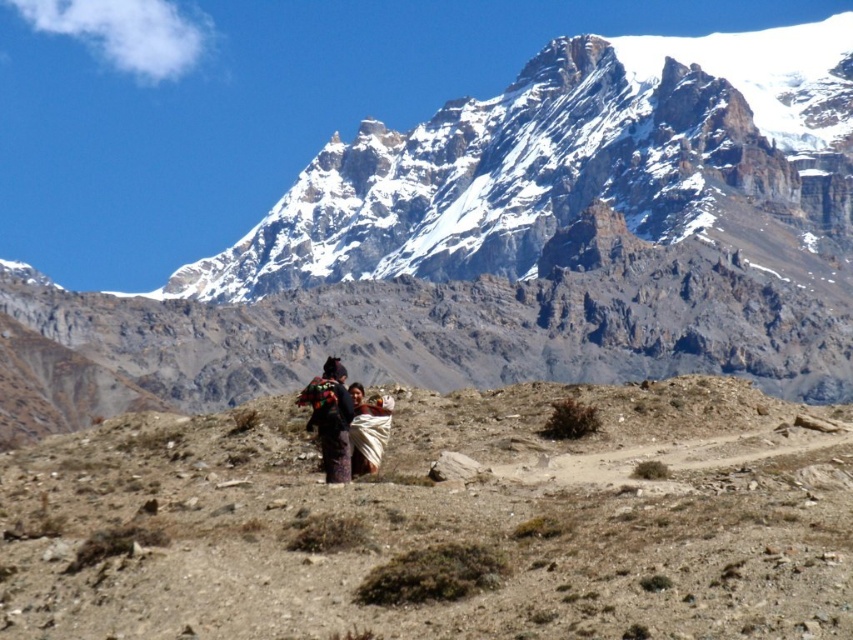
Who is positioned more to the left, brown textured hillside at center or multicolored woven shawl at center?

multicolored woven shawl at center

Which is above, brown textured hillside at center or multicolored woven shawl at center?

Positioned higher is multicolored woven shawl at center.

Locate an element on the screen. This screenshot has height=640, width=853. brown textured hillside at center is located at coordinates (440, 522).

At what (x,y) coordinates should I click in order to perform the action: click on brown textured hillside at center. Please return your answer as a coordinate pair (x, y). The height and width of the screenshot is (640, 853). Looking at the image, I should click on (440, 522).

Who is more forward, (x=339, y=252) or (x=335, y=388)?

Positioned in front is point (x=335, y=388).

Is point (515, 131) positioned behind point (334, 426)?

Yes, point (515, 131) is behind point (334, 426).

Where is `snowy granite mountain range at upper center`? The width and height of the screenshot is (853, 640). snowy granite mountain range at upper center is located at coordinates (509, 243).

Looking at this image, can you confirm if snowy granite mountain range at upper center is positioned to the right of brown textured hillside at center?

Yes, snowy granite mountain range at upper center is to the right of brown textured hillside at center.

Can you confirm if snowy granite mountain range at upper center is positioned below brown textured hillside at center?

Actually, snowy granite mountain range at upper center is above brown textured hillside at center.

Where is `snowy granite mountain range at upper center`? snowy granite mountain range at upper center is located at coordinates (509, 243).

The height and width of the screenshot is (640, 853). In order to click on snowy granite mountain range at upper center in this screenshot , I will do `click(509, 243)`.